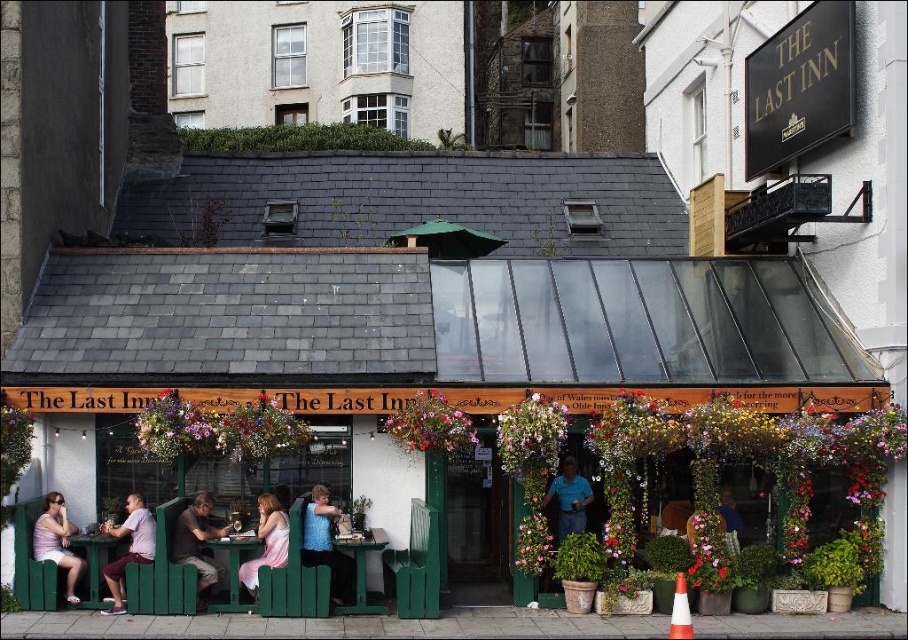
You are standing in front of The Last Inn and want to touch both the blue sleeveless top at center and the green wooden table at center. Which object should you reach for first?

You should reach for the blue sleeveless top at center first because it is closer to you than the green wooden table at center.

You are a guest at The Last Inn and want to hang a coat on the blue sleeveless top at center. However, there is a green wooden table at center nearby. Considering their heights, which object should you use to hang your coat?

The blue sleeveless top at center is taller than the green wooden table at center, so you should hang your coat on the blue sleeveless top at center since it is taller and provides a better height for hanging coats.

You are standing in front of The Last Inn and notice two guests approaching the entrance. One is wearing a light purple shirt at lower left, and the other is wearing a pink fabric dress at center. Which guest is closer to you?

The light purple shirt at lower left is closer to you because the pink fabric dress at center is behind it.